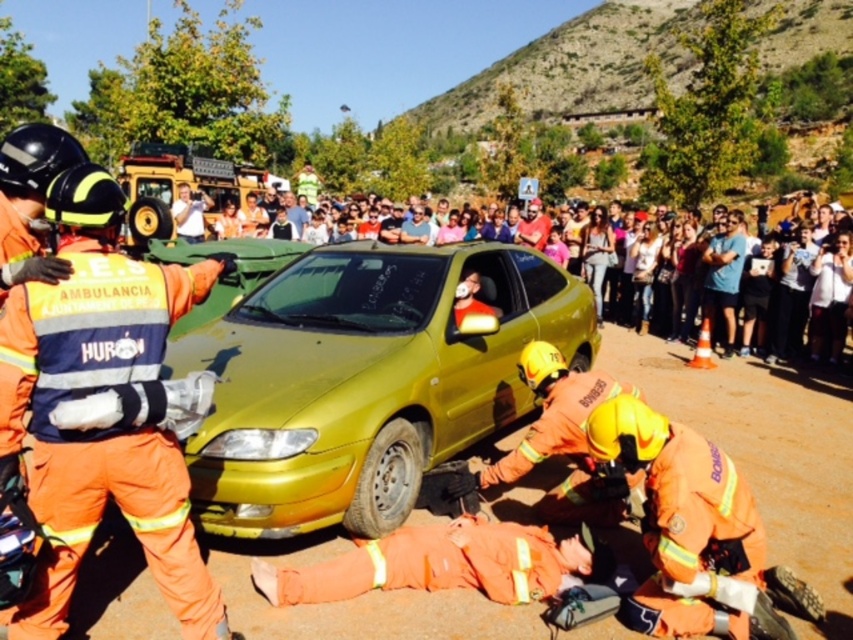
You are a member of the rescue team in the scene. You need to move the orange fabric fireman at left to a safer location. Can you move them without moving the gold matte car at center first?

The gold matte car at center is positioned over orange fabric fireman at left, so you must move the car first before you can move the fireman.

Looking at this image, you are a drone operator trying to capture the rescue team in action. You need to fly your drone from point A to point B. Point A is at coordinates point (88, 252) and point B is at coordinates point (297, 244). According to the scene, which point is closer to the rescue team member holding the stretcher?

Point (88, 252) is in front of point (297, 244), so it is closer to the rescue team member holding the stretcher.

You are a photographer at the scene. You need to capture a photo that includes both the orange fabric fireman at left and the multicolored casual clothing at upper center. Based on their positions, where should you position your camera to ensure both are visible in the frame?

The orange fabric fireman at left is below the multicolored casual clothing at upper center, so positioning the camera at a lower angle would allow both to be visible in the frame.